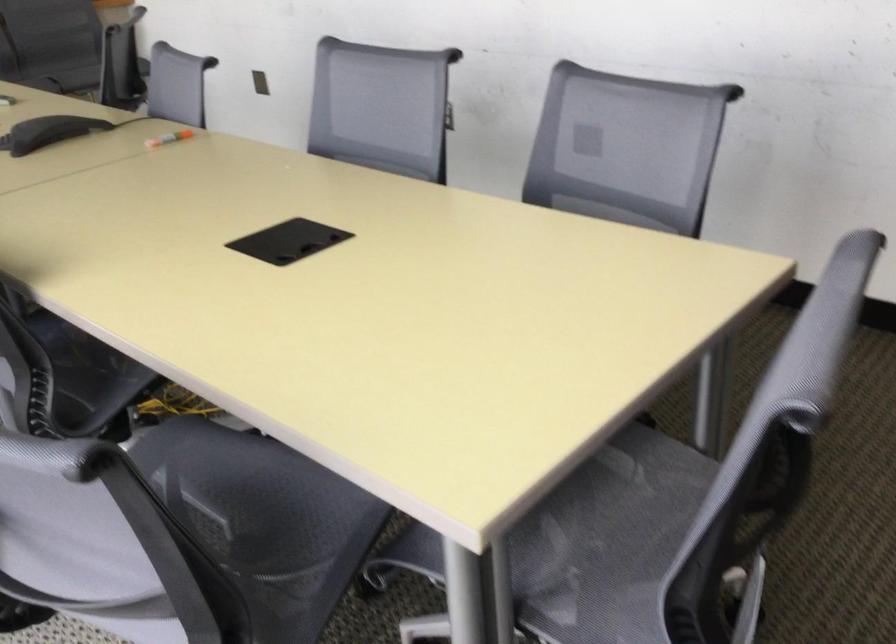
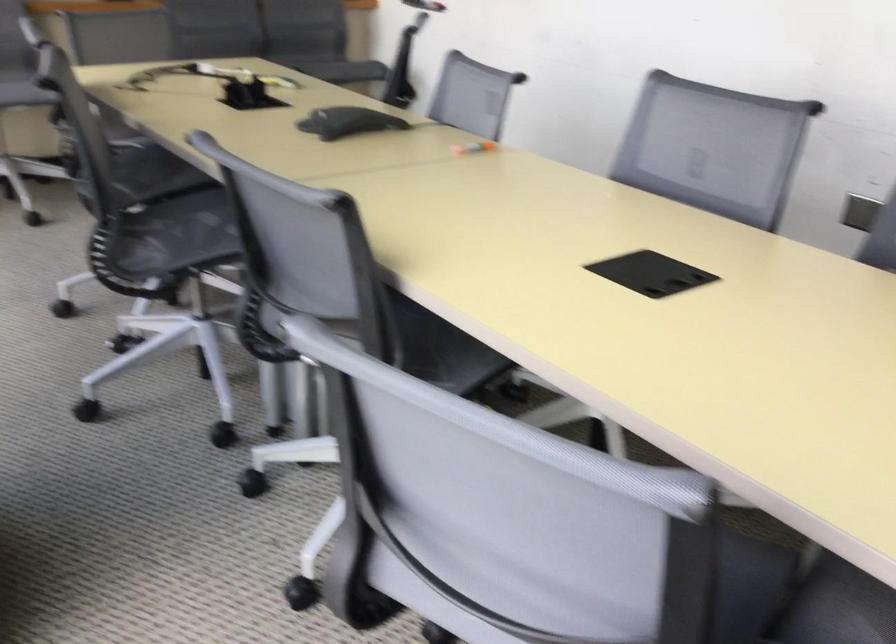
Locate, in the second image, the point that corresponds to [177,138] in the first image.

(474, 147)